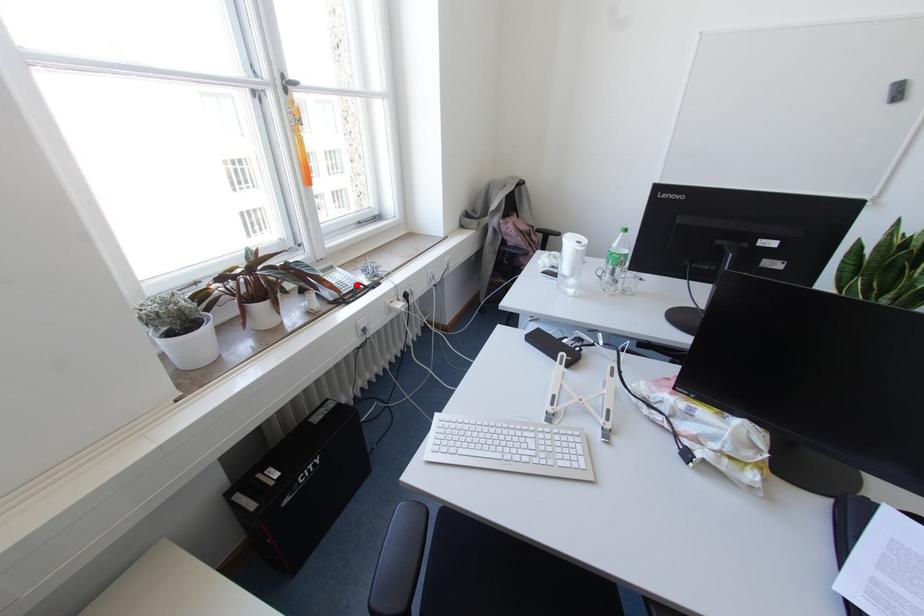
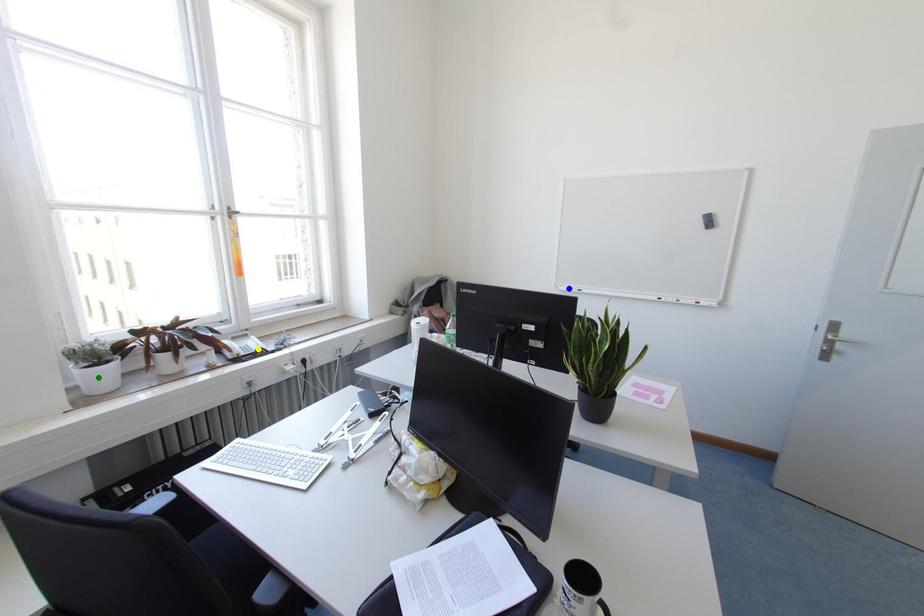
Question: I am providing you with two images of the same scene from different viewpoints. A red point is marked on the first image. You are given multiple points on the second image. Which point in image 2 represents the same 3d spot as the red point in image 1?

Choices:
 (A) green point
 (B) yellow point
 (C) blue point

Answer: (B)